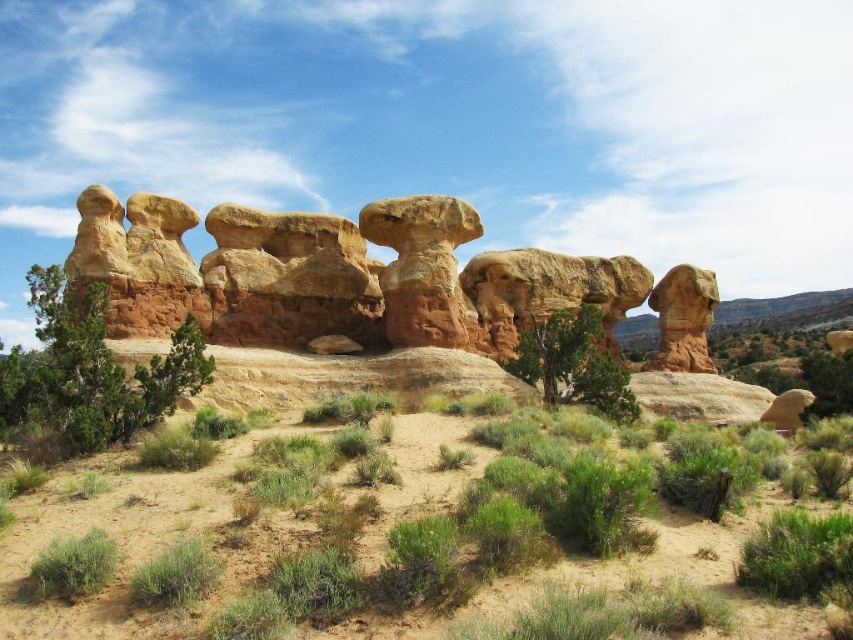
Question: Which point is closer to the camera?

Choices:
 (A) (543, 326)
 (B) (485, 410)
 (C) (601, 276)

Answer: (B)

Question: Which point is farther to the camera?

Choices:
 (A) pos(524,374)
 (B) pos(125,534)
 (C) pos(178,324)
 (D) pos(299,330)

Answer: (D)

Question: Does dull orange rock formation at center lie in front of rustic sandstone rock formation at center?

Choices:
 (A) no
 (B) yes

Answer: (B)

Question: Is green shrub at left thinner than green leafy bush at center?

Choices:
 (A) yes
 (B) no

Answer: (B)

Question: Estimate the real-world distances between objects in this image. Which object is closer to the dull orange rock formation at center?

Choices:
 (A) green leafy bush at center
 (B) green shrub at left
 (C) rustic sandstone rock formation at center

Answer: (B)

Question: Does rustic sandstone rock formation at center come in front of green leafy bush at center?

Choices:
 (A) yes
 (B) no

Answer: (A)